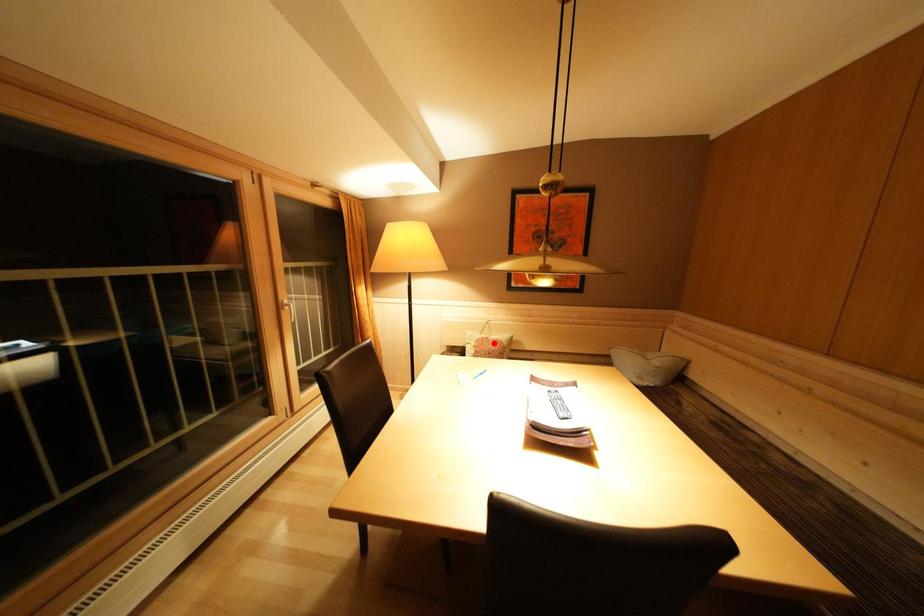
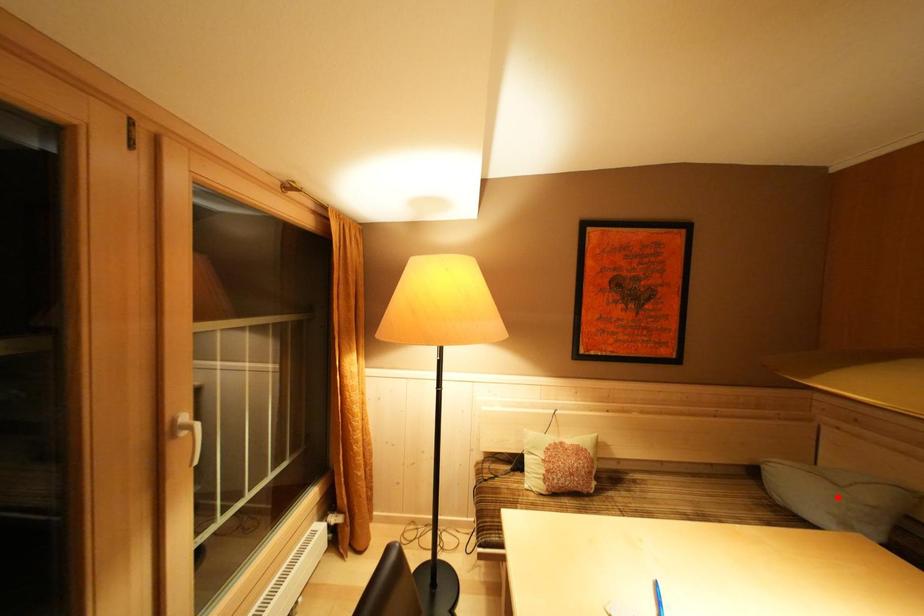
I am providing you with two images of the same scene from different viewpoints. A red point is marked on the first image and another point is marked on the second image. Is the marked point in image1 the same physical position as the marked point in image2?

No